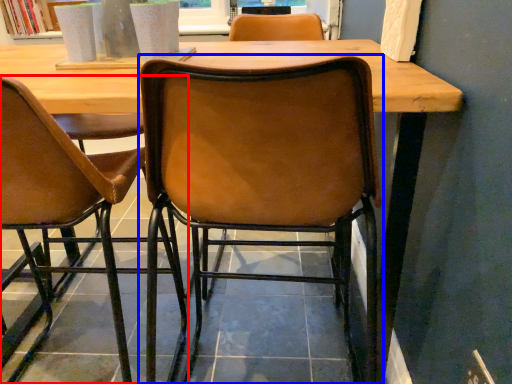
Question: Which object is closer to the camera taking this photo, chair (highlighted by a red box) or chair (highlighted by a blue box)?

Choices:
 (A) chair
 (B) chair

Answer: (B)